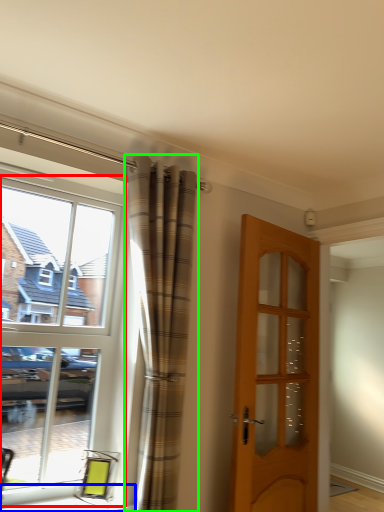
Question: Estimate the real-world distances between objects in this image. Which object is closer to window (highlighted by a red box), window sill (highlighted by a blue box) or curtain (highlighted by a green box)?

Choices:
 (A) window sill
 (B) curtain

Answer: (B)